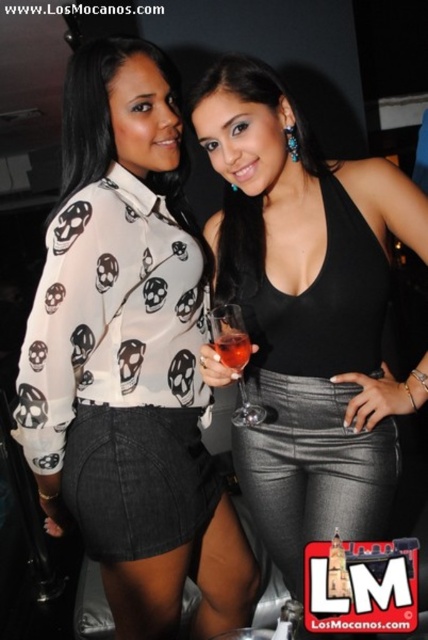
You are a photographer standing at the camera position. You want to adjust the focus to capture the white sheer blouse at upper left clearly. Given that the camera has a minimum focusing distance of 3 feet, will you need to move closer or farther away to achieve this?

The white sheer blouse at upper left and camera are 3.36 feet apart. Since the minimum focusing distance is 3 feet, you do not need to move closer. The distance is already within the camera s capability to focus.